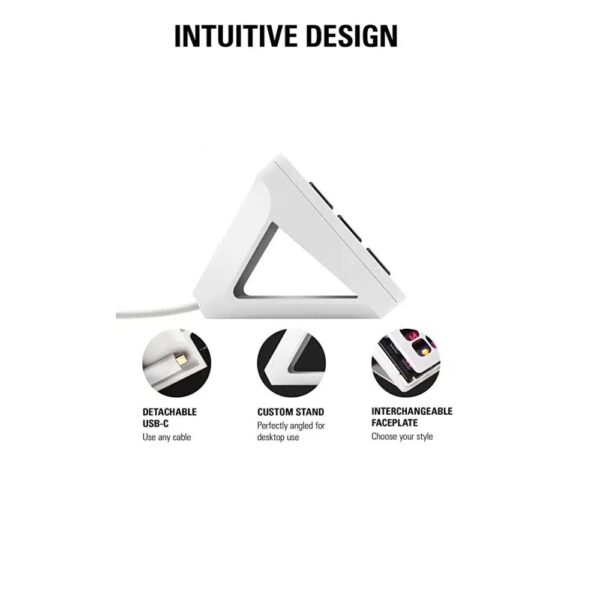
Locate an element on the screen. Image resolution: width=600 pixels, height=600 pixels. charger plug is located at coordinates (181, 361).